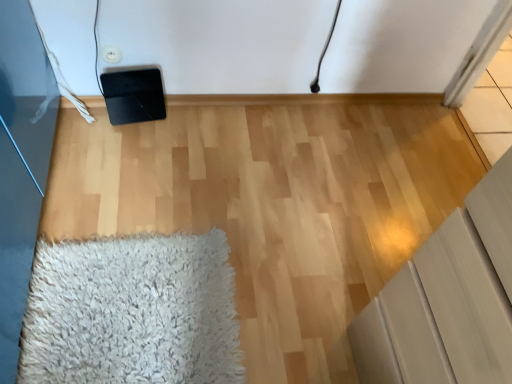
Where is `free location to the right of white shaggy rug at lower left`? free location to the right of white shaggy rug at lower left is located at coordinates (302, 283).